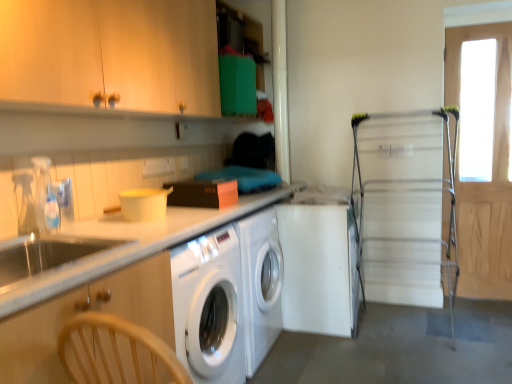
Question: Considering their positions, is white matte washing machine at center located in front of or behind metallic silver drying rack at right, placed as the 1th screen door when sorted from left to right?

Choices:
 (A) behind
 (B) front

Answer: (A)

Question: In terms of width, does white matte washing machine at center look wider or thinner when compared to metallic silver drying rack at right, placed as the 1th screen door when sorted from left to right?

Choices:
 (A) wide
 (B) thin

Answer: (B)

Question: Estimate the real-world distances between objects in this image. Which object is farther from the metallic silver drying rack at right, which appears as the second screen door when viewed from the right?

Choices:
 (A) white matte washing machine at center
 (B) wooden cabinet at left, marked as the second cabinetry in a top-to-bottom arrangement
 (C) white glossy countertop at left
 (D) wooden cabinet at upper left, which is the first cabinetry from top to bottom
 (E) wooden screen door at right, placed as the second screen door when sorted from left to right

Answer: (B)

Question: Which of these objects is positioned closest to the metallic silver drying rack at right, placed as the 1th screen door when sorted from left to right?

Choices:
 (A) white matte washing machine at center
 (B) wooden cabinet at upper left, acting as the second cabinetry starting from the bottom
 (C) wooden screen door at right, placed as the second screen door when sorted from left to right
 (D) wooden cabinet at left, which appears as the 1th cabinetry when ordered from the bottom
 (E) clear plastic faucet at left

Answer: (A)